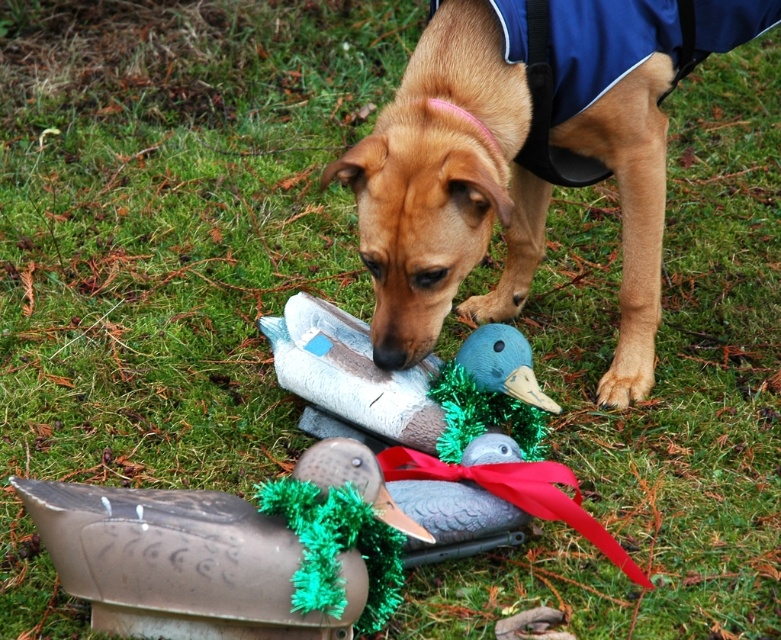
Who is positioned more to the left, metallic duck at lower center or metallic duck decoy at center?

metallic duck at lower center

Measure the distance from metallic duck at lower center to metallic duck decoy at center.

They are 21.93 inches apart.

Is point (154, 522) behind point (476, 368)?

No, (154, 522) is closer to viewer.

Identify the location of metallic duck at lower center. The image size is (781, 640). (180, 563).

Is brown matte dog at center positioned in front of metallic duck decoy at center?

Yes, brown matte dog at center is closer to the viewer.

Is brown matte dog at center to the right of metallic duck decoy at center from the viewer's perspective?

Indeed, brown matte dog at center is positioned on the right side of metallic duck decoy at center.

Which is in front, point (464, 56) or point (351, 323)?

Positioned in front is point (464, 56).

Find the location of `brown matte dog at center`. brown matte dog at center is located at coordinates (446, 180).

Between brown matte dog at center and metallic duck at lower center, which one appears on the right side from the viewer's perspective?

brown matte dog at center

Identify the location of brown matte dog at center. The height and width of the screenshot is (640, 781). (446, 180).

Does point (614, 3) lie behind point (225, 540)?

Yes, it is.

You are a GUI agent. You are given a task and a screenshot of the screen. Output one action in this format:
    pyautogui.click(x=<x>, y=<y>)
    Task: Click on the brown matte dog at center
    
    Given the screenshot: What is the action you would take?
    pyautogui.click(x=446, y=180)